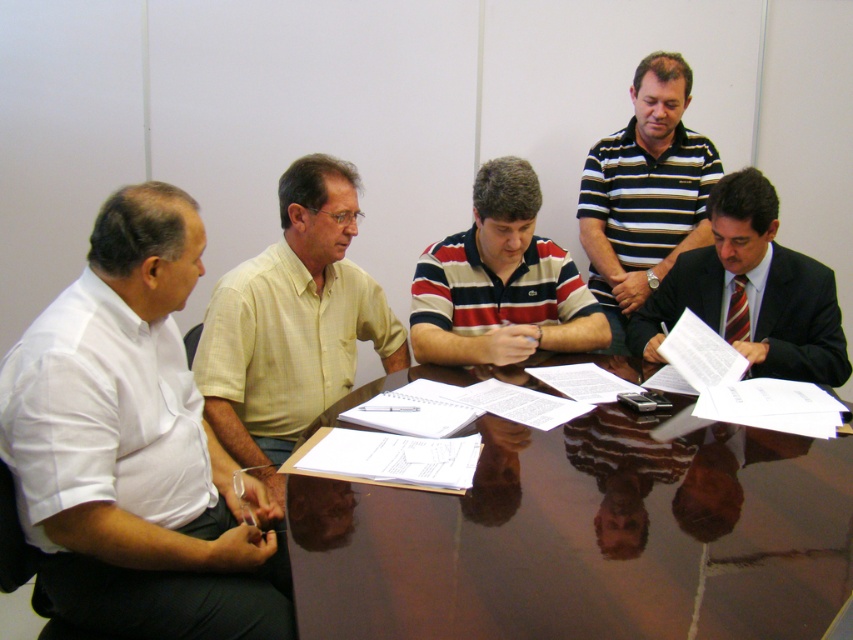
Question: Which is nearer to the striped cotton polo shirt at upper right?

Choices:
 (A) white shirt at left
 (B) yellow cotton shirt at upper left
 (C) dark suit at lower right
 (D) glossy brown table at center

Answer: (C)

Question: Does yellow cotton shirt at upper left have a larger size compared to dark suit at lower right?

Choices:
 (A) no
 (B) yes

Answer: (B)

Question: Which of the following is the closest to the observer?

Choices:
 (A) (752, 243)
 (B) (260, 506)
 (C) (428, 248)

Answer: (B)

Question: Is glossy brown table at center bigger than striped cotton polo shirt at upper right?

Choices:
 (A) yes
 (B) no

Answer: (A)

Question: Does glossy brown table at center have a smaller size compared to striped cotton polo shirt at upper right?

Choices:
 (A) yes
 (B) no

Answer: (B)

Question: Which object is farther from the camera taking this photo?

Choices:
 (A) glossy brown table at center
 (B) yellow cotton shirt at upper left
 (C) striped cotton shirt at center
 (D) striped cotton polo shirt at upper right

Answer: (D)